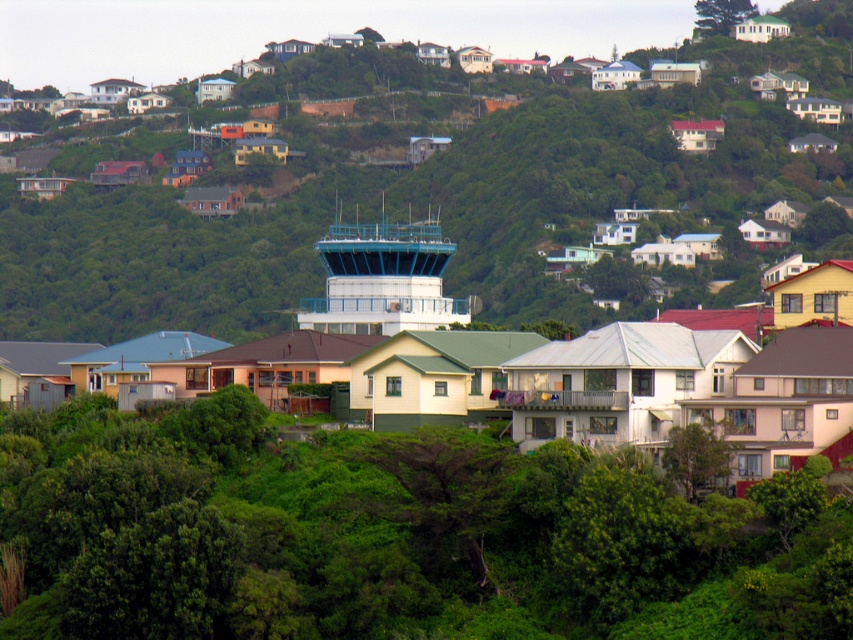
Question: Which object is the farthest from the green leafy tree at center?

Choices:
 (A) green leafy tree at upper center
 (B) white smooth control tower at center

Answer: (A)

Question: Which point is closer to the camera?

Choices:
 (A) (706, 29)
 (B) (328, 268)

Answer: (B)

Question: Can you confirm if green leafy tree at center is positioned to the left of green leafy tree at upper center?

Choices:
 (A) no
 (B) yes

Answer: (B)

Question: Which object appears farthest from the camera in this image?

Choices:
 (A) green leafy tree at upper center
 (B) green leafy tree at center
 (C) white smooth control tower at center

Answer: (A)

Question: Does green leafy tree at center have a greater width compared to green leafy tree at upper center?

Choices:
 (A) yes
 (B) no

Answer: (A)

Question: Can you confirm if green leafy tree at center is positioned to the right of green leafy tree at upper center?

Choices:
 (A) yes
 (B) no

Answer: (B)